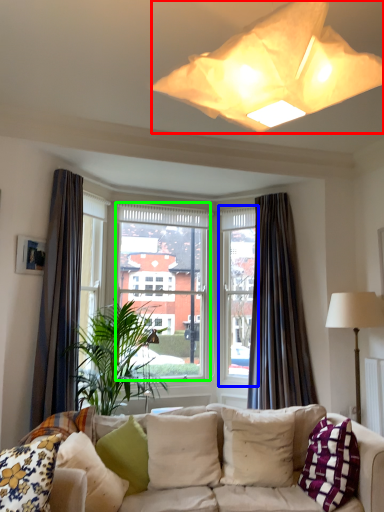
Question: Estimate the real-world distances between objects in this image. Which object is closer to lamp (highlighted by a red box), window frame (highlighted by a blue box) or window screen (highlighted by a green box)?

Choices:
 (A) window frame
 (B) window screen

Answer: (B)